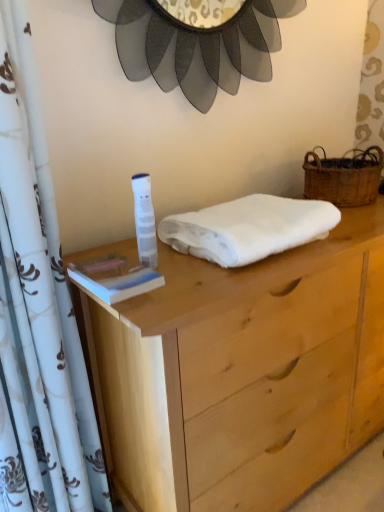
At what (x,y) coordinates should I click in order to perform the action: click on vacant space behind white plastic tube at center. Please return your answer as a coordinate pair (x, y). The width and height of the screenshot is (384, 512). Looking at the image, I should click on pyautogui.click(x=155, y=247).